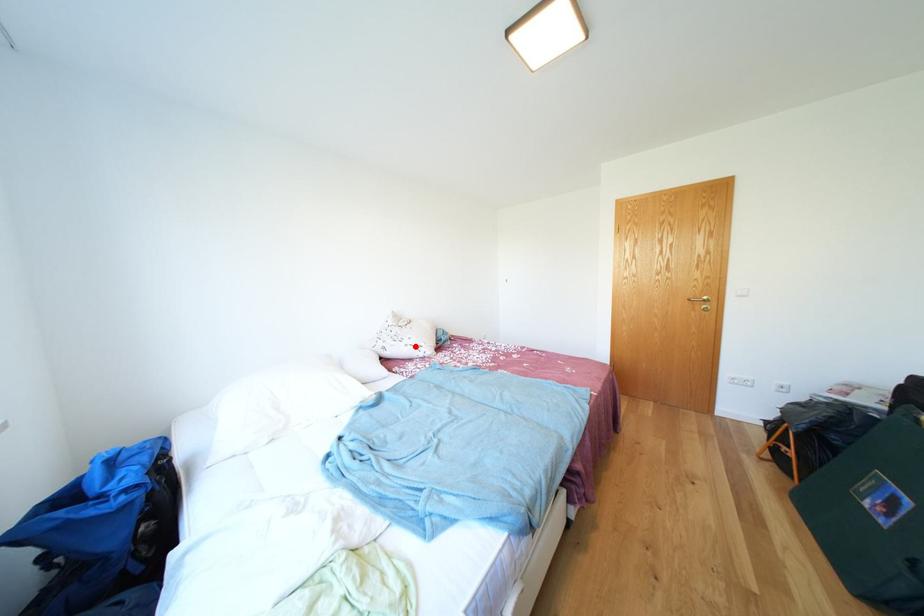
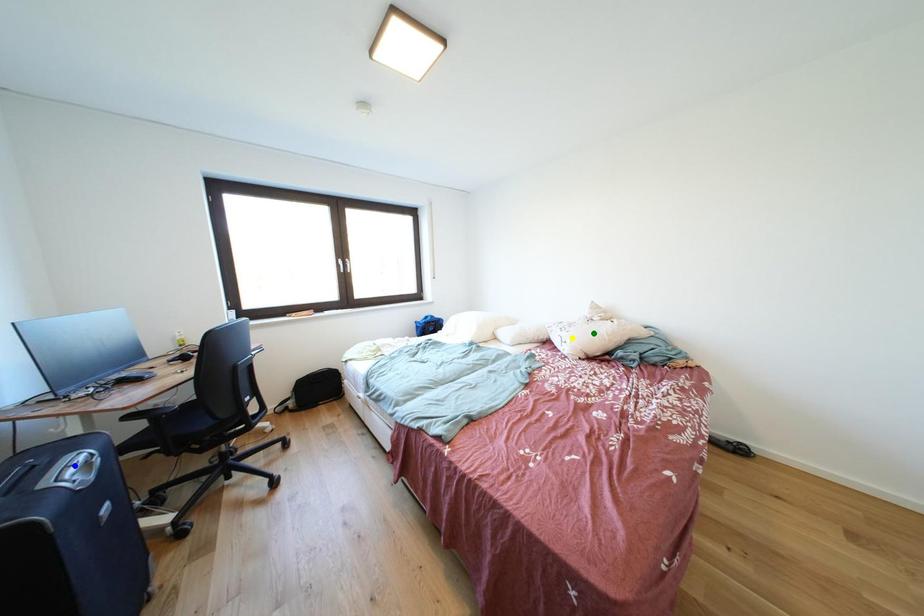
Question: I am providing you with two images of the same scene from different viewpoints. A red point is marked on the first image. You are given multiple points on the second image. Which point in image 2 is actually the same real-world point as the red point in image 1?

Choices:
 (A) green point
 (B) blue point
 (C) yellow point

Answer: (C)